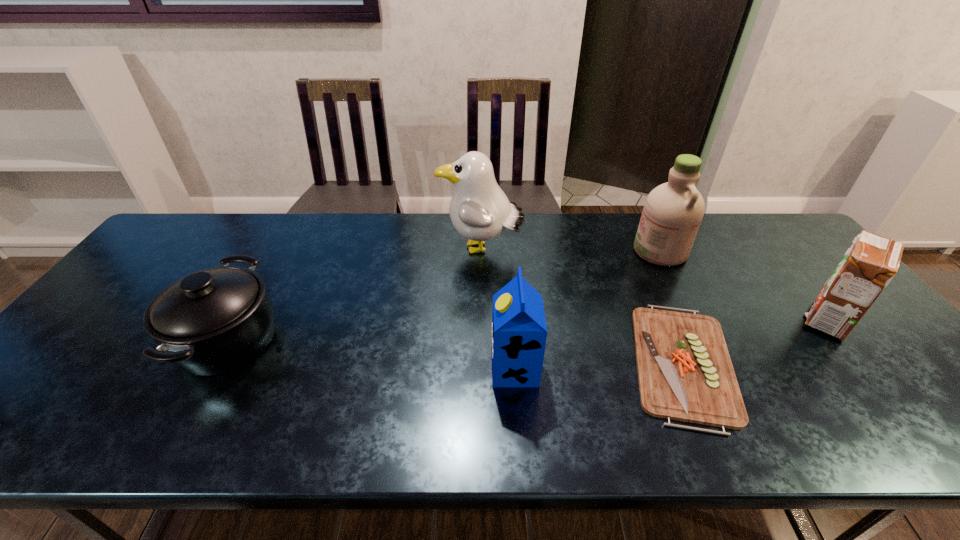
Where is `gull`? Image resolution: width=960 pixels, height=540 pixels. gull is located at coordinates (479, 210).

Where is `cleansing agent`? cleansing agent is located at coordinates (673, 211).

You are a GUI agent. You are given a task and a screenshot of the screen. Output one action in this format:
    pyautogui.click(x=<x>, y=<y>)
    Task: Click on the nearer carton
    The width and height of the screenshot is (960, 540).
    Given the screenshot: What is the action you would take?
    pyautogui.click(x=519, y=332)

In order to click on the right carton in this screenshot , I will do `click(867, 267)`.

You are a GUI agent. You are given a task and a screenshot of the screen. Output one action in this format:
    pyautogui.click(x=<x>, y=<y>)
    Task: Click on the farther carton
    This screenshot has width=960, height=540.
    Given the screenshot: What is the action you would take?
    pyautogui.click(x=867, y=267)

You are a GUI agent. You are given a task and a screenshot of the screen. Output one action in this format:
    pyautogui.click(x=<x>, y=<y>)
    Task: Click on the leftmost object
    The height and width of the screenshot is (540, 960).
    Given the screenshot: What is the action you would take?
    pyautogui.click(x=213, y=321)

Image resolution: width=960 pixels, height=540 pixels. I want to click on the second shortest object, so click(213, 321).

At what (x,y) coordinates should I click in order to perform the action: click on chopping board. Please return your answer as a coordinate pair (x, y). The image size is (960, 540). Looking at the image, I should click on (685, 373).

At what (x,y) coordinates should I click in order to perform the action: click on free region located 0.320m on the beak of the gull. Please return your answer as a coordinate pair (x, y). The width and height of the screenshot is (960, 540). Looking at the image, I should click on (338, 250).

You are a GUI agent. You are given a task and a screenshot of the screen. Output one action in this format:
    pyautogui.click(x=<x>, y=<y>)
    Task: Click on the free space located on the beak of the gull
    
    Given the screenshot: What is the action you would take?
    pyautogui.click(x=423, y=250)